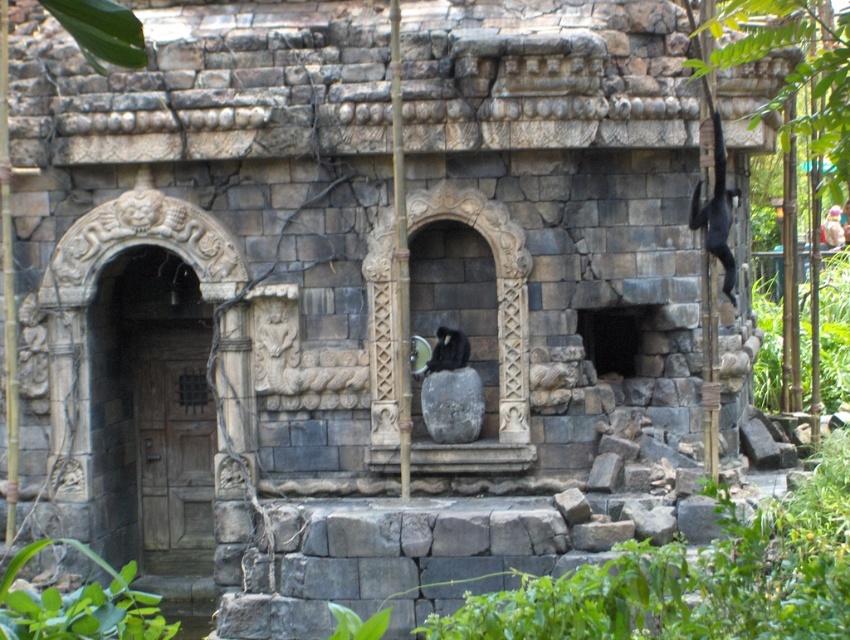
Question: Can you confirm if green leafy plant at upper right is wider than green leafy plant at right?

Choices:
 (A) yes
 (B) no

Answer: (A)

Question: Does green leafy plant at upper right have a lesser width compared to green leafy plant at lower left?

Choices:
 (A) yes
 (B) no

Answer: (B)

Question: Which of the following is the closest to the observer?

Choices:
 (A) (763, 353)
 (B) (116, 582)

Answer: (B)

Question: Observing the image, what is the correct spatial positioning of green leafy plant at upper right in reference to green leafy plant at right?

Choices:
 (A) left
 (B) right

Answer: (A)

Question: Which object is positioned closest to the green leafy plant at right?

Choices:
 (A) green leafy plant at lower left
 (B) green leafy plant at upper right

Answer: (B)

Question: Estimate the real-world distances between objects in this image. Which object is farther from the green leafy plant at upper right?

Choices:
 (A) green leafy plant at right
 (B) green leafy plant at lower left

Answer: (B)